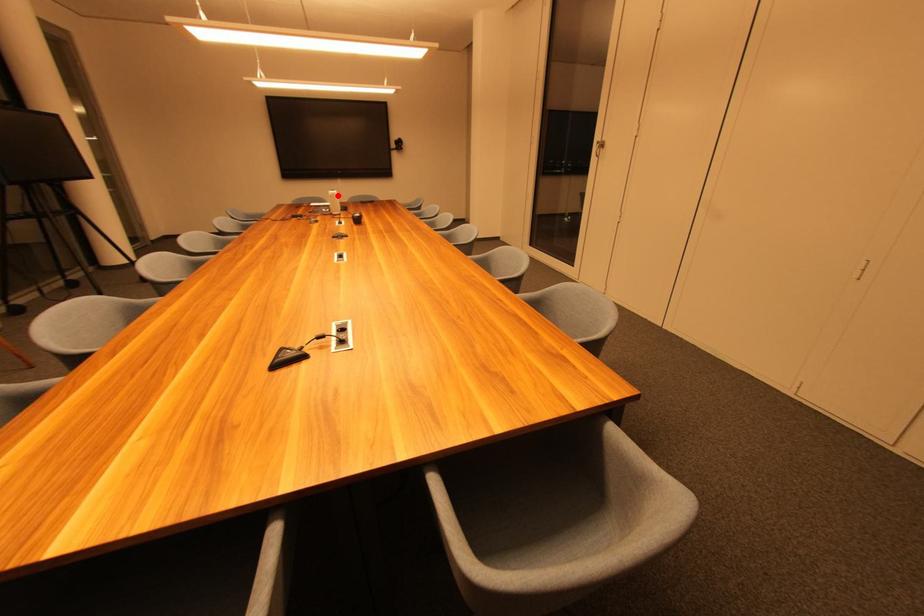
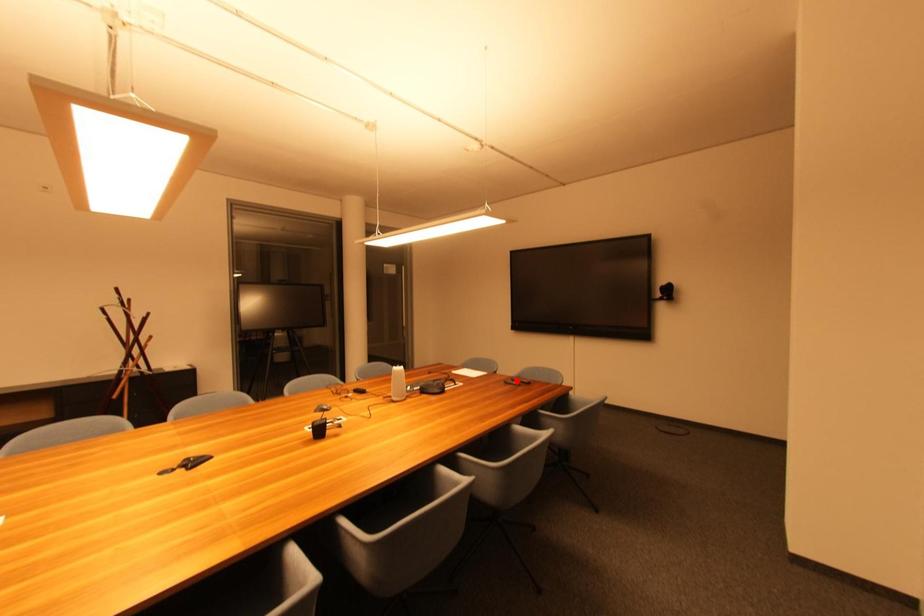
I am providing you with two images of the same scene from different viewpoints. A red point is marked on the first image and another point is marked on the second image. Do the highlighted points in image1 and image2 indicate the same real-world spot?

No